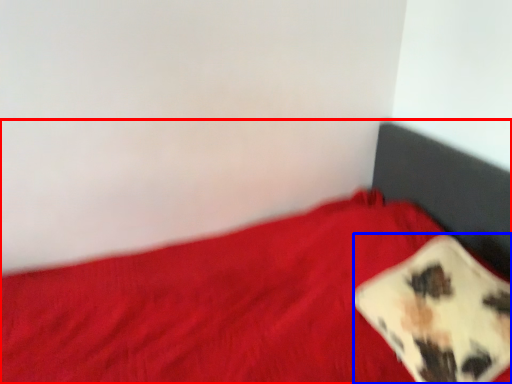
Question: Which point is further to the camera, bed (highlighted by a red box) or pillow (highlighted by a blue box)?

Choices:
 (A) bed
 (B) pillow

Answer: (B)